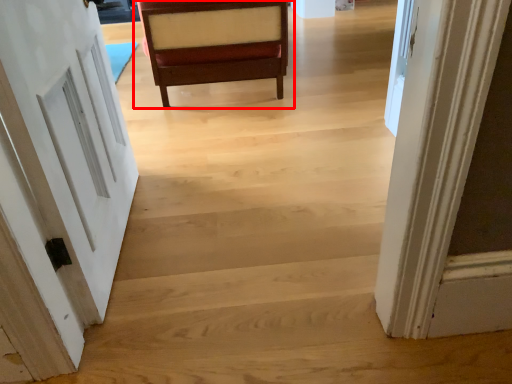
Question: Where is chair (annotated by the red box) located in relation to door in the image?

Choices:
 (A) right
 (B) left

Answer: (A)